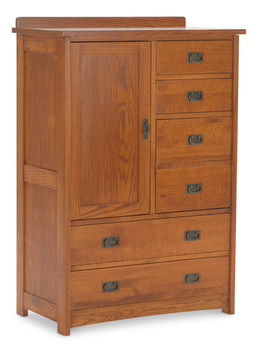
You are a GUI agent. You are given a task and a screenshot of the screen. Output one action in this format:
    pyautogui.click(x=<x>, y=<y>)
    Task: Click on the handle
    
    Given the screenshot: What is the action you would take?
    pyautogui.click(x=111, y=242), pyautogui.click(x=147, y=130), pyautogui.click(x=191, y=59), pyautogui.click(x=189, y=95), pyautogui.click(x=194, y=144), pyautogui.click(x=195, y=186), pyautogui.click(x=194, y=234), pyautogui.click(x=192, y=279), pyautogui.click(x=112, y=286)